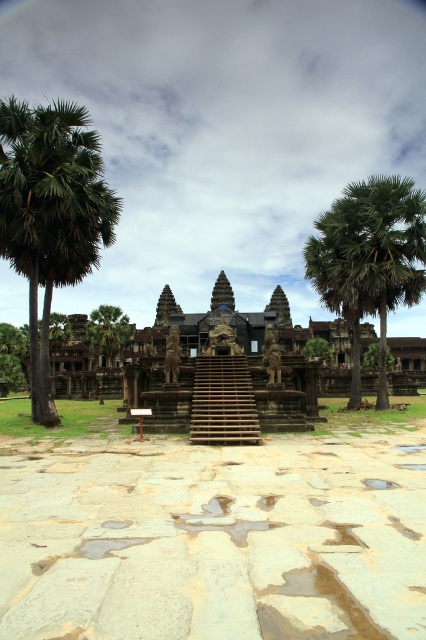
Question: Is green leafy palm tree at left below green leafy palm tree at right?

Choices:
 (A) no
 (B) yes

Answer: (A)

Question: Can you confirm if green leafy palm tree at left is positioned to the right of green leafy palm tree at right?

Choices:
 (A) yes
 (B) no

Answer: (B)

Question: Does green leafy palm tree at left appear on the left side of green leafy palm tree at right?

Choices:
 (A) yes
 (B) no

Answer: (A)

Question: Which point is closer to the camera taking this photo?

Choices:
 (A) (377, 273)
 (B) (36, 202)

Answer: (B)

Question: Among these objects, which one is nearest to the camera?

Choices:
 (A) green leafy palm tree at right
 (B) green leafy palm tree at left

Answer: (B)